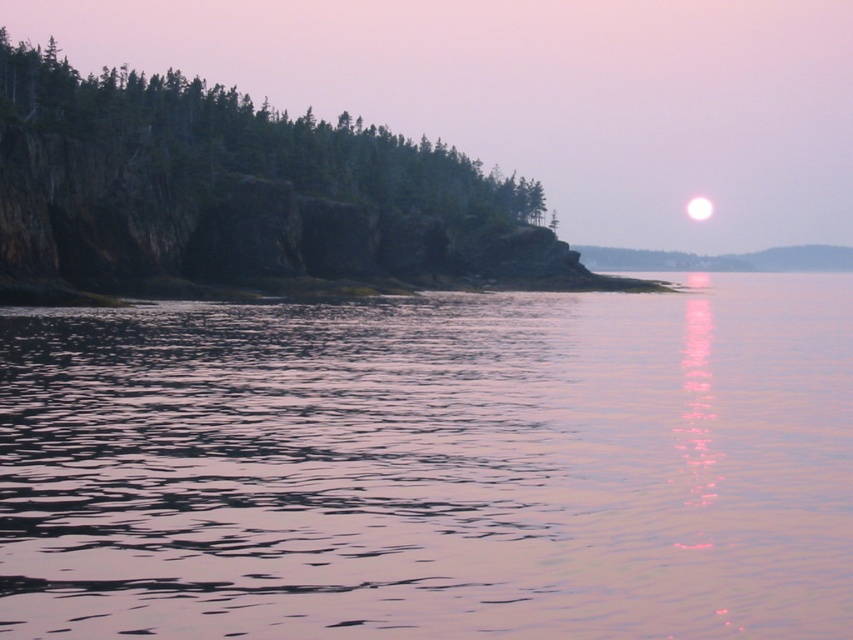
Based on the photo, you are standing at the waterline in the coastal scene and see two points marked in the image. The first point is at coordinates point (451, 209) and the second is at point (704, 204). Which point is closer to you?

Point (451, 209) is in front of point (704, 204), so the first point is closer to you.

You are a bird soaring above the coastal scene. You want to land on the highest object between the green matte trees at upper left and the white glossy moon at upper right. Which one should you choose?

The green matte trees at upper left is taller than the white glossy moon at upper right, so you should choose the green matte trees at upper left to land on.